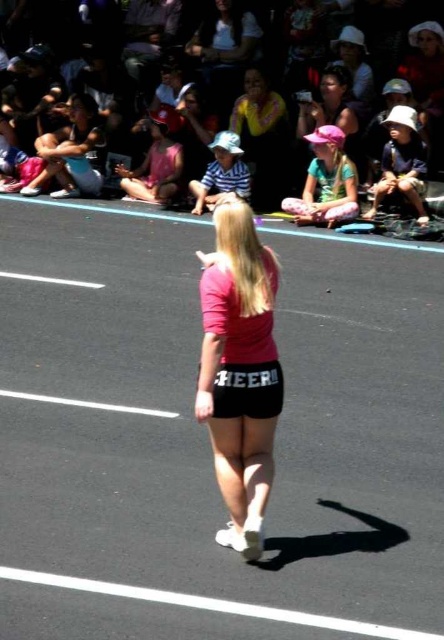
Consider the image. Is pink matte shorts at center shorter than yellow jersey at upper center?

Indeed, pink matte shorts at center has a lesser height compared to yellow jersey at upper center.

Who is shorter, pink matte shorts at center or yellow jersey at upper center?

Standing shorter between the two is pink matte shorts at center.

You are a GUI agent. You are given a task and a screenshot of the screen. Output one action in this format:
    pyautogui.click(x=<x>, y=<y>)
    Task: Click on the pink matte shorts at center
    
    Given the screenshot: What is the action you would take?
    pyautogui.click(x=240, y=371)

At what (x,y) coordinates should I click in order to perform the action: click on pink matte shorts at center. Please return your answer as a coordinate pair (x, y). The width and height of the screenshot is (444, 640). Looking at the image, I should click on (240, 371).

The image size is (444, 640). I want to click on matte pink shorts at center, so click(290, 42).

Can you confirm if matte pink shorts at center is positioned below pink fabric hat at center?

No, matte pink shorts at center is not below pink fabric hat at center.

Is point (380, 13) farther from camera compared to point (344, 173)?

Yes, point (380, 13) is farther from viewer.

Image resolution: width=444 pixels, height=640 pixels. In order to click on matte pink shorts at center in this screenshot , I will do `click(290, 42)`.

Between matte pink shorts at center and white cotton hat at upper right, which one has more height?

With more height is white cotton hat at upper right.

Describe the element at coordinates (290, 42) in the screenshot. I see `matte pink shorts at center` at that location.

Locate an element on the screen. matte pink shorts at center is located at coordinates [290, 42].